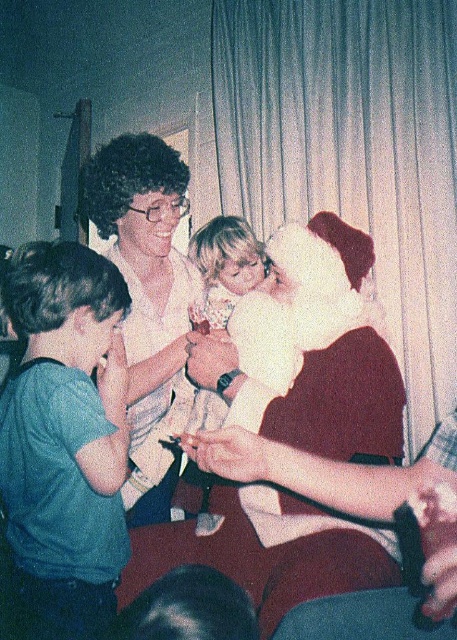
You are organizing a holiday photo shoot and need to ensure proper lighting for two outfits displayed at the center of the scene. The white matte shirt at center and the smooth white dress at center must be lit evenly. Considering their sizes, which outfit requires a larger light source to achieve the same level of illumination?

The white matte shirt at center is much taller than the smooth white dress at center, so it requires a larger light source to achieve the same level of illumination.

You are standing in the room and want to see both the point at coordinates point (174, 358) and the point at coordinates point (208, 356). Which coordinate point is closer to you?

Point (208, 356) is closer to you because it is in front of point (174, 358).

You are organizing a holiday photo shoot and need to ensure proper visibility of all clothing items. Given that the white matte shirt at center and the smooth white dress at center are both in the frame, which clothing item is positioned closer to the camera?

The white matte shirt at center is positioned closer to the camera because it is in front of the smooth white dress at center.